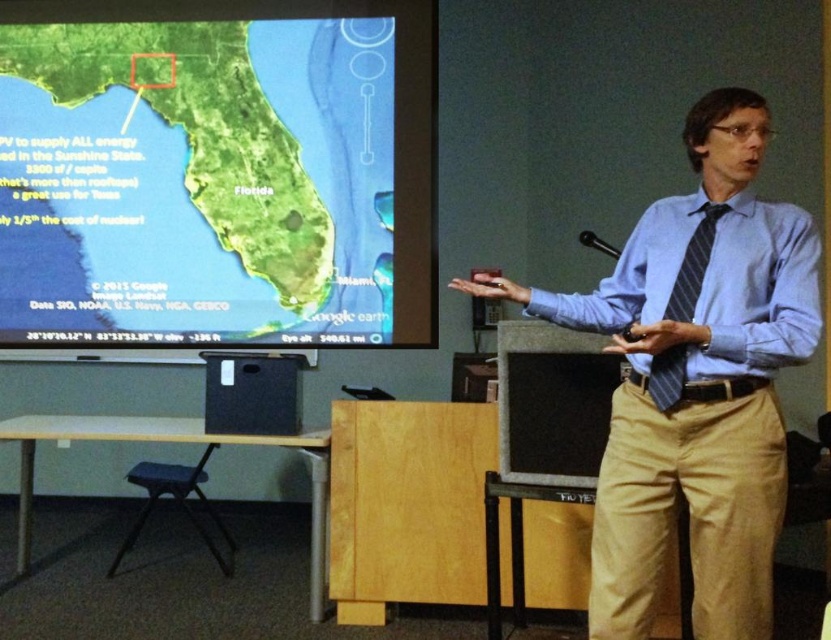
Question: Can you confirm if blue striped tie at center is positioned to the left of black plastic podium at lower left?

Choices:
 (A) no
 (B) yes

Answer: (A)

Question: Does black plastic podium at lower left appear under wooden stool at lower left?

Choices:
 (A) yes
 (B) no

Answer: (B)

Question: Which point is closer to the camera?

Choices:
 (A) (202, 465)
 (B) (42, 20)

Answer: (A)

Question: Which point is closer to the camera?

Choices:
 (A) blue striped tie at center
 (B) black matte speaker at center

Answer: (A)

Question: Does green matte map at upper left appear under black plastic podium at lower left?

Choices:
 (A) no
 (B) yes

Answer: (A)

Question: Estimate the real-world distances between objects in this image. Which object is farther from the green matte map at upper left?

Choices:
 (A) wooden stool at lower left
 (B) blue striped dress shirt at right
 (C) blue striped tie at center
 (D) black plastic podium at lower left

Answer: (B)